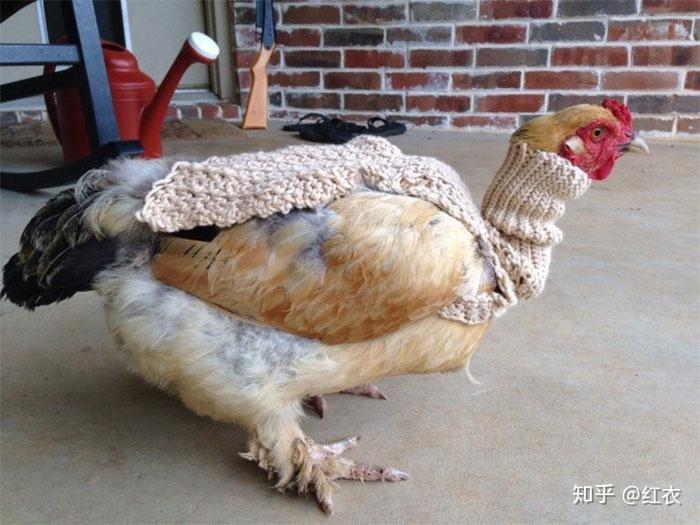
Where is `floor`? Image resolution: width=700 pixels, height=525 pixels. floor is located at coordinates (595, 332).